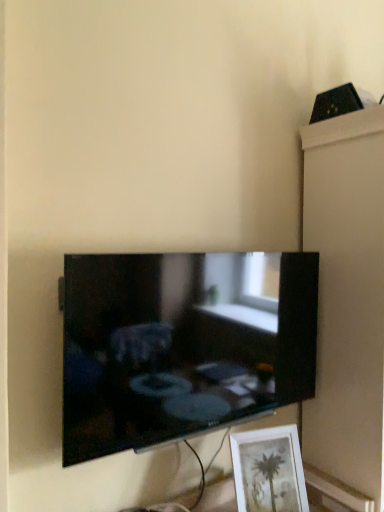
Question: Looking at their shapes, would you say matte white picture frame at lower right is wider or thinner than white glossy cabinet at upper right?

Choices:
 (A) thin
 (B) wide

Answer: (A)

Question: Is point (249, 444) positioned closer to the camera than point (357, 321)?

Choices:
 (A) closer
 (B) farther

Answer: (A)

Question: Estimate the real-world distances between objects in this image. Which object is farther from the matte white picture frame at lower right?

Choices:
 (A) black glossy tv at center
 (B) white glossy cabinet at upper right

Answer: (B)

Question: Which of these objects is positioned farthest from the matte white picture frame at lower right?

Choices:
 (A) white glossy cabinet at upper right
 (B) black glossy tv at center

Answer: (A)